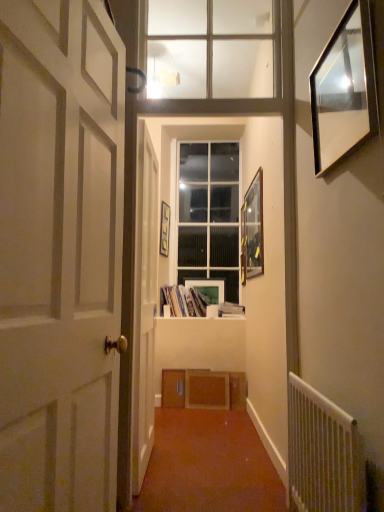
Question: Can you see white painted wood door at left, which is the first door from front to back, touching white metal radiator at lower right?

Choices:
 (A) yes
 (B) no

Answer: (B)

Question: Is white metal radiator at lower right inside white painted wood door at left, the 2th door positioned from the back?

Choices:
 (A) yes
 (B) no

Answer: (B)

Question: Is white painted wood door at left, the 2th door positioned from the back, at the left side of white metal radiator at lower right?

Choices:
 (A) no
 (B) yes

Answer: (B)

Question: Can you confirm if white painted wood door at left, which is the first door from front to back, is bigger than white metal radiator at lower right?

Choices:
 (A) no
 (B) yes

Answer: (B)

Question: Would you consider white painted wood door at left, which is the first door from front to back, to be distant from white metal radiator at lower right?

Choices:
 (A) no
 (B) yes

Answer: (A)

Question: Would you say silver metallic picture frame at upper right, which is counted as the 1th picture frame, starting from the front, is to the left or to the right of clear glass window at upper center, the second window positioned from the back, in the picture?

Choices:
 (A) left
 (B) right

Answer: (B)

Question: Choose the correct answer: Is silver metallic picture frame at upper right, arranged as the second picture frame when viewed from the right, inside clear glass window at upper center, which is the 1th window from front to back, or outside it?

Choices:
 (A) outside
 (B) inside

Answer: (A)

Question: From a real-world perspective, relative to clear glass window at upper center, the second window positioned from the back, is silver metallic picture frame at upper right, marked as the 3th picture frame in a left-to-right arrangement, vertically above or below?

Choices:
 (A) below
 (B) above

Answer: (A)

Question: From the image's perspective, is silver metallic picture frame at upper right, which is counted as the 1th picture frame, starting from the front, positioned above or below clear glass window at upper center, which is the 1th window from front to back?

Choices:
 (A) below
 (B) above

Answer: (A)

Question: Is matte white picture frame at center, marked as the second picture frame in a left-to-right arrangement, bigger or smaller than white paper book at center, arranged as the 1th book when viewed from the right?

Choices:
 (A) big
 (B) small

Answer: (B)

Question: From a real-world perspective, is matte white picture frame at center, the third picture frame when ordered from right to left, physically located above or below white paper book at center, arranged as the 1th book when viewed from the right?

Choices:
 (A) below
 (B) above

Answer: (B)

Question: Is matte white picture frame at center, marked as the second picture frame in a left-to-right arrangement, taller or shorter than white paper book at center, which appears as the 2th book when viewed from the left?

Choices:
 (A) short
 (B) tall

Answer: (B)

Question: Considering the positions of point (223, 286) and point (233, 315), is point (223, 286) closer or farther from the camera than point (233, 315)?

Choices:
 (A) farther
 (B) closer

Answer: (A)

Question: Considering the positions of wooden picture frame at right, the 1th picture frame positioned from the right, and white paper book at center, which appears as the 2th book when viewed from the left, in the image, is wooden picture frame at right, the 1th picture frame positioned from the right, bigger or smaller than white paper book at center, which appears as the 2th book when viewed from the left,?

Choices:
 (A) small
 (B) big

Answer: (B)

Question: Would you say wooden picture frame at right, the third picture frame from the back, is to the left or to the right of white paper book at center, arranged as the 1th book when viewed from the right, in the picture?

Choices:
 (A) right
 (B) left

Answer: (A)